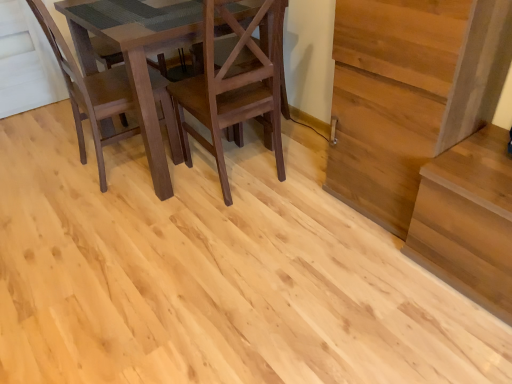
Question: From the image's perspective, is dark brown wood chair at left, which is the 2th chair in right-to-left order, located above or below matte brown chair at center, which is the first chair in right-to-left order?

Choices:
 (A) above
 (B) below

Answer: (A)

Question: Considering the positions of dark brown wood chair at left, which is the 2th chair in right-to-left order, and matte brown chair at center, which is the first chair in right-to-left order, in the image, is dark brown wood chair at left, which is the 2th chair in right-to-left order, wider or thinner than matte brown chair at center, which is the first chair in right-to-left order,?

Choices:
 (A) thin
 (B) wide

Answer: (A)

Question: Which object is positioned closest to the dark brown wood chair at left, which is the 2th chair in right-to-left order?

Choices:
 (A) matte brown chair at center, acting as the second chair starting from the left
 (B) light brown wood stairs at right

Answer: (A)

Question: Which is nearer to the light brown wood stairs at right?

Choices:
 (A) matte brown chair at center, acting as the second chair starting from the left
 (B) dark brown wood chair at left, which is the 2th chair in right-to-left order

Answer: (A)